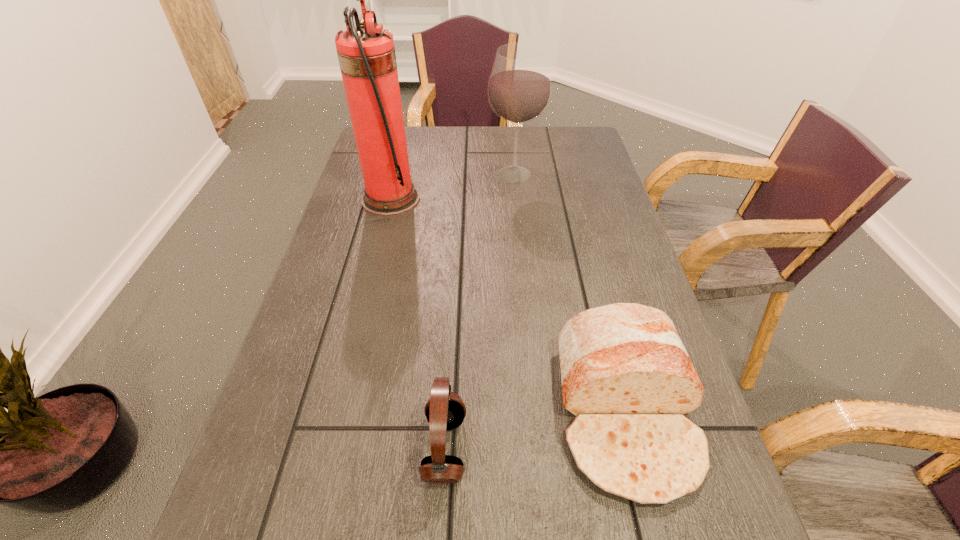
Find the location of `vacant region between the tallest object and the alcohol`. vacant region between the tallest object and the alcohol is located at coordinates (452, 187).

Where is `free space between the bread and the fire extinguisher`? This screenshot has height=540, width=960. free space between the bread and the fire extinguisher is located at coordinates (508, 306).

You are a GUI agent. You are given a task and a screenshot of the screen. Output one action in this format:
    pyautogui.click(x=<x>, y=<y>)
    Task: Click on the vacant area that lies between the alcohol and the second object from left to right
    
    Given the screenshot: What is the action you would take?
    pyautogui.click(x=480, y=312)

This screenshot has height=540, width=960. What are the coordinates of `free space between the leftmost object and the headset` in the screenshot? It's located at (418, 323).

Locate which object is the third closest to the fire extinguisher. Please provide its 2D coordinates. Your answer should be formatted as a tuple, i.e. [(x, y)], where the tuple contains the x and y coordinates of a point satisfying the conditions above.

[(445, 410)]

Identify which object is located as the second nearest to the alcohol. Please provide its 2D coordinates. Your answer should be formatted as a tuple, i.e. [(x, y)], where the tuple contains the x and y coordinates of a point satisfying the conditions above.

[(625, 374)]

Locate an element on the screen. The width and height of the screenshot is (960, 540). free spot that satisfies the following two spatial constraints: 1. on the front side of the second tallest object; 2. at the discharge end of the leftmost object is located at coordinates (516, 199).

Identify the location of vacant area that satisfies the following two spatial constraints: 1. at the sliced end of the bread; 2. on the ear pads of the third object from right to left. coord(635,448).

Locate an element on the screen. free location that satisfies the following two spatial constraints: 1. at the sliced end of the bread; 2. on the ear pads of the third object from right to left is located at coordinates (635, 448).